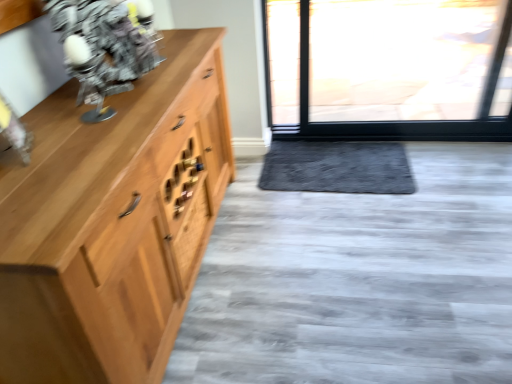
Question: Can you confirm if metallic silver robot at upper left is taller than wooden drawer at center?

Choices:
 (A) no
 (B) yes

Answer: (B)

Question: Is metallic silver robot at upper left smaller than wooden drawer at center?

Choices:
 (A) no
 (B) yes

Answer: (A)

Question: From the image's perspective, is metallic silver robot at upper left under wooden drawer at center?

Choices:
 (A) yes
 (B) no

Answer: (B)

Question: Could wooden drawer at center be considered to be inside metallic silver robot at upper left?

Choices:
 (A) yes
 (B) no

Answer: (B)

Question: Is metallic silver robot at upper left positioned in front of wooden drawer at center?

Choices:
 (A) yes
 (B) no

Answer: (A)

Question: From the image's perspective, relative to gray plush doormat at center, is wooden drawer at center above or below?

Choices:
 (A) below
 (B) above

Answer: (A)

Question: From a real-world perspective, is wooden drawer at center positioned above or below gray plush doormat at center?

Choices:
 (A) above
 (B) below

Answer: (A)

Question: Considering their positions, is wooden drawer at center located in front of or behind gray plush doormat at center?

Choices:
 (A) behind
 (B) front

Answer: (B)

Question: Considering the relative positions of wooden drawer at center and gray plush doormat at center in the image provided, is wooden drawer at center to the left or to the right of gray plush doormat at center?

Choices:
 (A) left
 (B) right

Answer: (A)

Question: Is gray plush doormat at center situated inside wooden drawer at center or outside?

Choices:
 (A) outside
 (B) inside

Answer: (A)

Question: Based on their positions, is gray plush doormat at center located to the left or right of wooden drawer at center?

Choices:
 (A) left
 (B) right

Answer: (B)

Question: Relative to wooden drawer at center, is gray plush doormat at center in front or behind?

Choices:
 (A) behind
 (B) front

Answer: (A)

Question: In terms of size, does gray plush doormat at center appear bigger or smaller than wooden drawer at center?

Choices:
 (A) big
 (B) small

Answer: (A)

Question: Considering the positions of point (190, 218) and point (101, 8), is point (190, 218) closer or farther from the camera than point (101, 8)?

Choices:
 (A) farther
 (B) closer

Answer: (A)

Question: From a real-world perspective, is wooden drawer at center above or below metallic silver robot at upper left?

Choices:
 (A) above
 (B) below

Answer: (B)